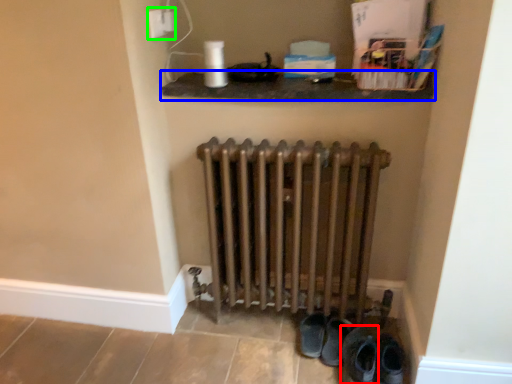
Question: Estimate the real-world distances between objects in this image. Which object is closer to footwear (highlighted by a red box), shelf (highlighted by a blue box) or electric outlet (highlighted by a green box)?

Choices:
 (A) shelf
 (B) electric outlet

Answer: (A)